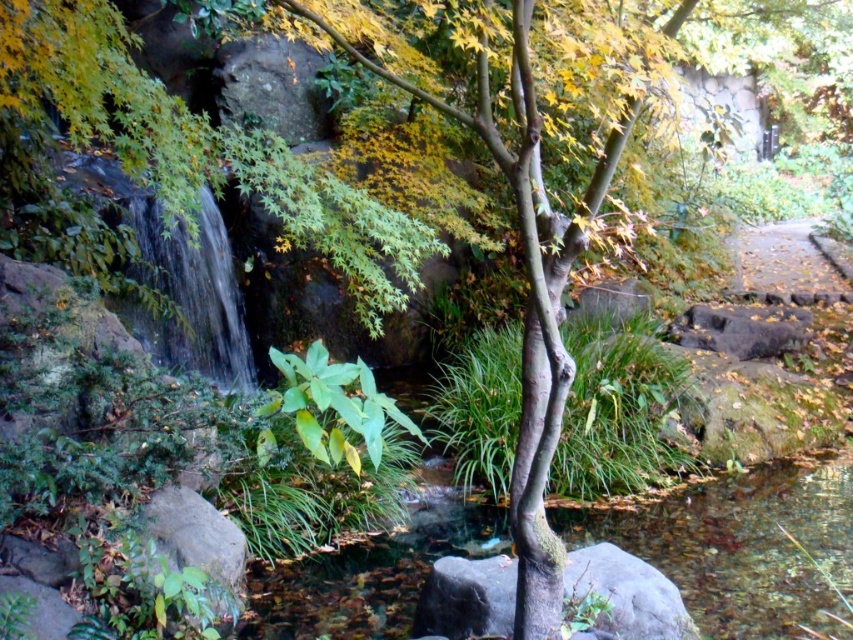
Which is in front, point (187, 300) or point (738, 273)?

Point (187, 300) is in front.

Between point (163, 291) and point (786, 292), which one is positioned behind?

The point (786, 292) is more distant.

Is point (216, 348) farther from camera compared to point (840, 273)?

No, it is in front of (840, 273).

I want to click on clear water at center, so click(190, 294).

Between gray rough rock at center and brown dirt path at right, which one has less height?

Standing shorter between the two is gray rough rock at center.

Image resolution: width=853 pixels, height=640 pixels. Identify the location of gray rough rock at center. (625, 595).

Does clear water at center have a lesser width compared to gray rough rock at center?

Yes.

Does clear water at center have a greater height compared to gray rough rock at center?

Yes, clear water at center is taller than gray rough rock at center.

Between point (212, 225) and point (625, 586), which one is positioned in front?

Positioned in front is point (625, 586).

At what (x,y) coordinates should I click in order to perform the action: click on clear water at center. Please return your answer as a coordinate pair (x, y). This screenshot has width=853, height=640. Looking at the image, I should click on (190, 294).